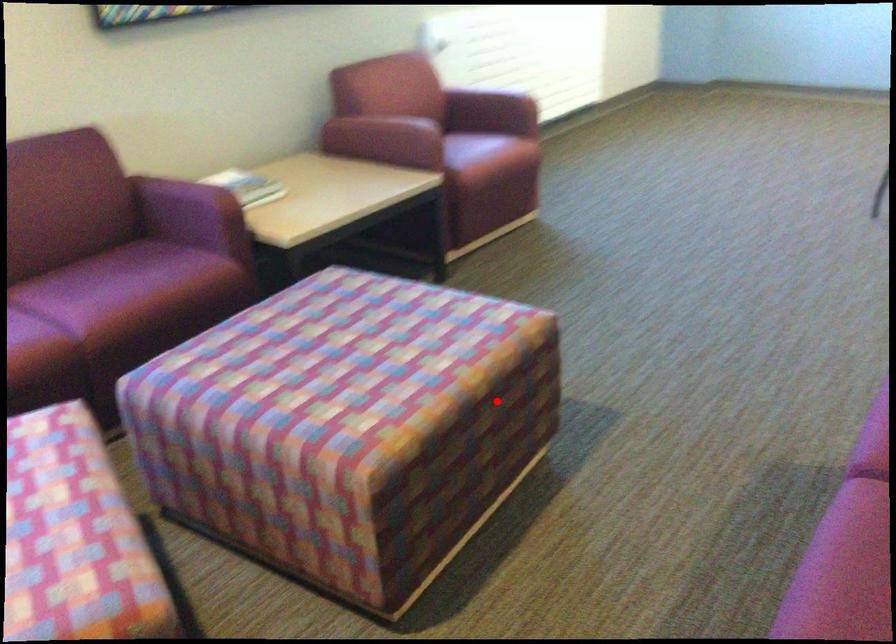
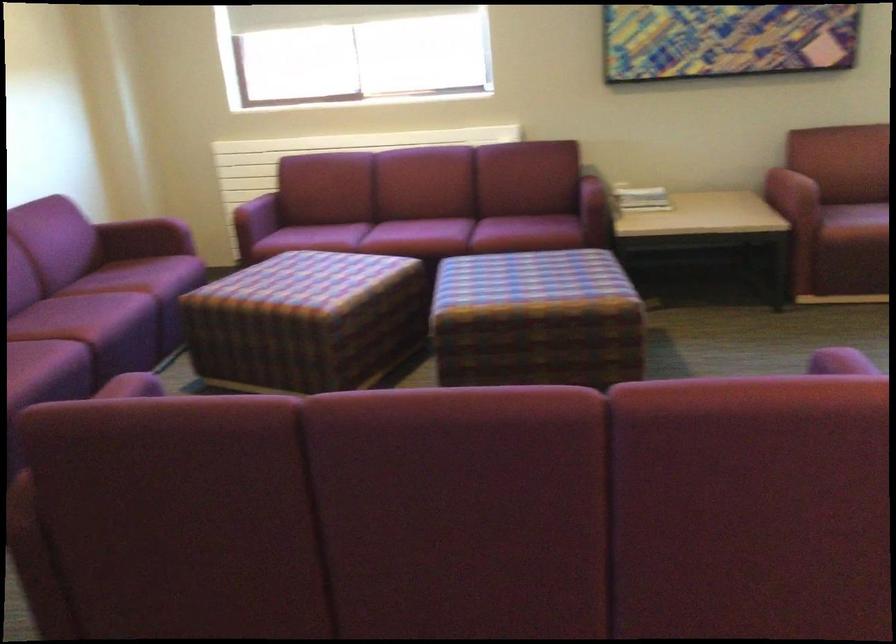
Locate, in the second image, the point that corresponds to the highlighted location in the first image.

(536, 319)